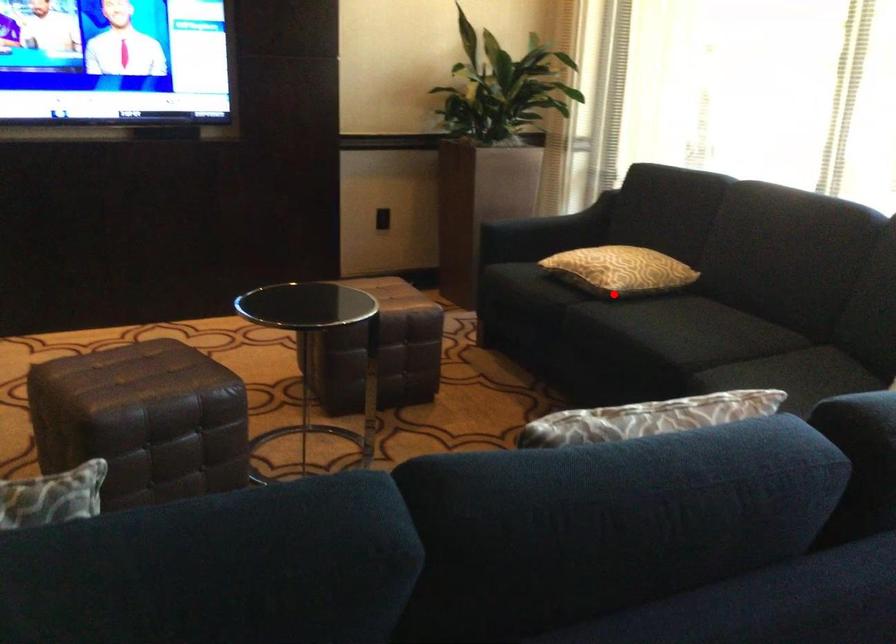
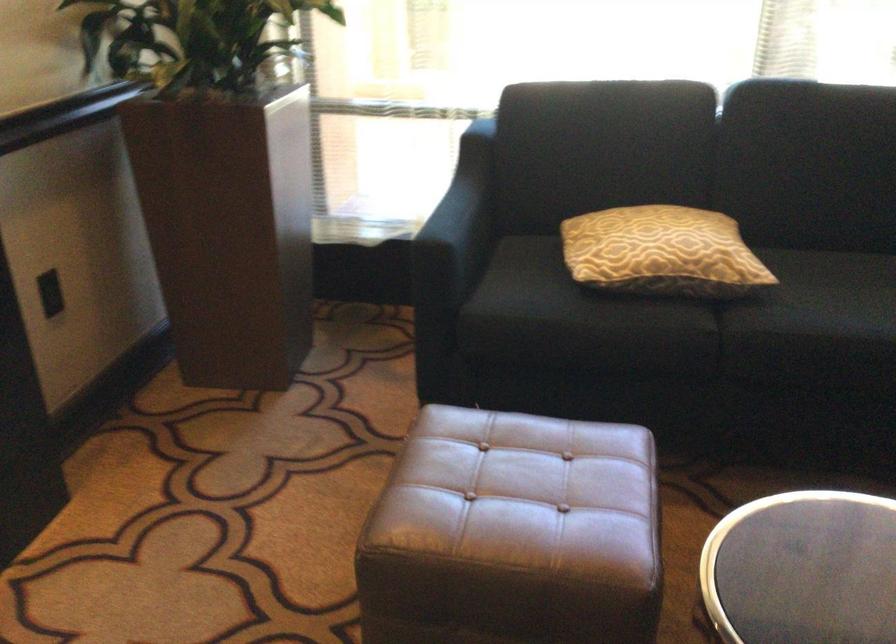
Question: I am providing you with two images of the same scene from different viewpoints. Given a red point in image1, look at the same physical point in image2. Is it:

Choices:
 (A) Closer to the viewpoint
 (B) Farther from the viewpoint

Answer: (A)